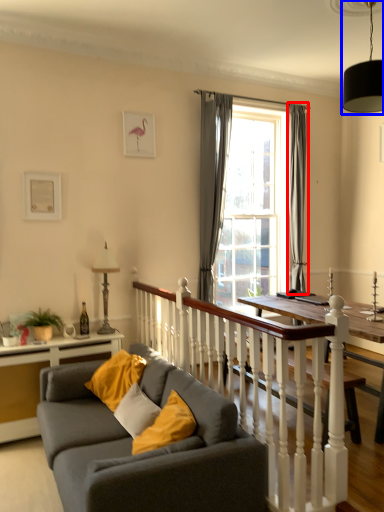
Question: Which point is closer to the camera, curtain (highlighted by a red box) or light fixture (highlighted by a blue box)?

Choices:
 (A) curtain
 (B) light fixture

Answer: (B)